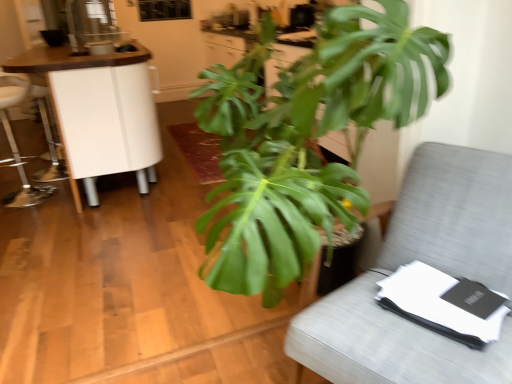
Locate an element on the screen. white glossy cabinet at left is located at coordinates (100, 111).

Locate an element on the screen. The height and width of the screenshot is (384, 512). metallic silver swivel chair at left is located at coordinates (16, 144).

Find the location of a particular element. The image size is (512, 384). white glossy cabinet at left is located at coordinates pyautogui.click(x=100, y=111).

Is metallic silver swivel chair at left completely or partially inside white glossy cabinet at left?

Yes, metallic silver swivel chair at left can be found within white glossy cabinet at left.

Is white glossy cabinet at left at the left side of metallic silver swivel chair at left?

In fact, white glossy cabinet at left is to the right of metallic silver swivel chair at left.

Looking at the image, does white glossy cabinet at left seem bigger or smaller compared to metallic silver swivel chair at left?

Clearly, white glossy cabinet at left is larger in size than metallic silver swivel chair at left.

From a real-world perspective, is white glossy cabinet at left positioned above or below metallic silver swivel chair at left?

From a real-world perspective, white glossy cabinet at left is physically above metallic silver swivel chair at left.

Based on the photo, is green leafy plant at center closer to the viewer compared to metallic silver swivel chair at left?

Yes, it is.

Locate an element on the screen. swivel chair below the green leafy plant at center (from a real-world perspective) is located at coordinates (16, 144).

Is green leafy plant at center not close to metallic silver swivel chair at left?

Absolutely, green leafy plant at center is distant from metallic silver swivel chair at left.

Considering the sizes of objects green leafy plant at center and metallic silver swivel chair at left in the image provided, who is smaller, green leafy plant at center or metallic silver swivel chair at left?

With smaller size is metallic silver swivel chair at left.

From a real-world perspective, is gray fabric chair at right located beneath green leafy plant at center?

Yes, from a real-world perspective, gray fabric chair at right is below green leafy plant at center.

Is gray fabric chair at right smaller than green leafy plant at center?

Indeed, gray fabric chair at right has a smaller size compared to green leafy plant at center.

Does gray fabric chair at right lie behind green leafy plant at center?

Yes, gray fabric chair at right is further from the camera.

Is gray fabric chair at right looking in the opposite direction of green leafy plant at center?

Yes, gray fabric chair at right is facing away from green leafy plant at center.

Considering the positions of points (23, 78) and (281, 146), is point (23, 78) farther from camera compared to point (281, 146)?

Yes, it is behind point (281, 146).

Which of these two, metallic silver swivel chair at left or green leafy plant at center, is wider?

green leafy plant at center is wider.

From a real-world perspective, does metallic silver swivel chair at left sit lower than green leafy plant at center?

Yes, from a real-world perspective, metallic silver swivel chair at left is below green leafy plant at center.

Considering the sizes of metallic silver swivel chair at left and gray fabric chair at right in the image, is metallic silver swivel chair at left taller or shorter than gray fabric chair at right?

metallic silver swivel chair at left is taller than gray fabric chair at right.

At what (x,y) coordinates should I click in order to perform the action: click on swivel chair behind the gray fabric chair at right. Please return your answer as a coordinate pair (x, y). This screenshot has height=384, width=512. Looking at the image, I should click on (16, 144).

Is metallic silver swivel chair at left facing towards gray fabric chair at right?

No, metallic silver swivel chair at left is not facing towards gray fabric chair at right.

Are metallic silver swivel chair at left and white glossy cabinet at left beside each other?

metallic silver swivel chair at left is not next to white glossy cabinet at left, and they're not touching.

Is white glossy cabinet at left located within metallic silver swivel chair at left?

No, white glossy cabinet at left is not surrounded by metallic silver swivel chair at left.

Is metallic silver swivel chair at left closer to camera compared to white glossy cabinet at left?

No, metallic silver swivel chair at left is behind white glossy cabinet at left.

From a real-world perspective, who is located higher, metallic silver swivel chair at left or white glossy cabinet at left?

From a 3D spatial view, white glossy cabinet at left is above.

Can we say gray fabric chair at right lies outside metallic silver swivel chair at left?

Yes, gray fabric chair at right is outside of metallic silver swivel chair at left.

Which object is wider, gray fabric chair at right or metallic silver swivel chair at left?

Wider between the two is gray fabric chair at right.

Considering the sizes of objects gray fabric chair at right and metallic silver swivel chair at left in the image provided, who is bigger, gray fabric chair at right or metallic silver swivel chair at left?

With larger size is gray fabric chair at right.

You are a GUI agent. You are given a task and a screenshot of the screen. Output one action in this format:
    pyautogui.click(x=<x>, y=<y>)
    Task: Click on the swivel chair on the left of white glossy cabinet at left
    This screenshot has height=384, width=512.
    Given the screenshot: What is the action you would take?
    pyautogui.click(x=16, y=144)

At what (x,y) coordinates should I click in order to perform the action: click on houseplant on the right of metallic silver swivel chair at left. Please return your answer as a coordinate pair (x, y). The image size is (512, 384). Looking at the image, I should click on click(305, 139).

From the image, which object appears to be nearer to gray fabric chair at right, metallic silver swivel chair at left or white glossy cabinet at left?

white glossy cabinet at left.

Which object lies further to the anchor point green leafy plant at center, gray fabric chair at right or metallic silver swivel chair at left?

metallic silver swivel chair at left is positioned further to the anchor green leafy plant at center.

Based on their spatial positions, is metallic silver swivel chair at left or white glossy cabinet at left further from green leafy plant at center?

metallic silver swivel chair at left.

Looking at the image, which one is located closer to white glossy cabinet at left, metallic silver swivel chair at left or gray fabric chair at right?

metallic silver swivel chair at left is closer to white glossy cabinet at left.

Considering their positions, is metallic silver swivel chair at left positioned further to white glossy cabinet at left than green leafy plant at center?

Among the two, green leafy plant at center is located further to white glossy cabinet at left.

When comparing their distances from gray fabric chair at right, does green leafy plant at center or white glossy cabinet at left seem further?

white glossy cabinet at left.

Based on their spatial positions, is white glossy cabinet at left or metallic silver swivel chair at left closer to green leafy plant at center?

white glossy cabinet at left lies closer to green leafy plant at center than the other object.

Considering their positions, is gray fabric chair at right positioned closer to white glossy cabinet at left than metallic silver swivel chair at left?

Based on the image, metallic silver swivel chair at left appears to be nearer to white glossy cabinet at left.

Find the location of a particular element. houseplant between white glossy cabinet at left and gray fabric chair at right from left to right is located at coordinates (305, 139).

Locate an element on the screen. The width and height of the screenshot is (512, 384). houseplant situated between metallic silver swivel chair at left and gray fabric chair at right from left to right is located at coordinates (305, 139).

Identify the location of table between metallic silver swivel chair at left and gray fabric chair at right from left to right. (100, 111).

Where is `table between green leafy plant at center and metallic silver swivel chair at left from front to back`? The image size is (512, 384). table between green leafy plant at center and metallic silver swivel chair at left from front to back is located at coordinates (100, 111).